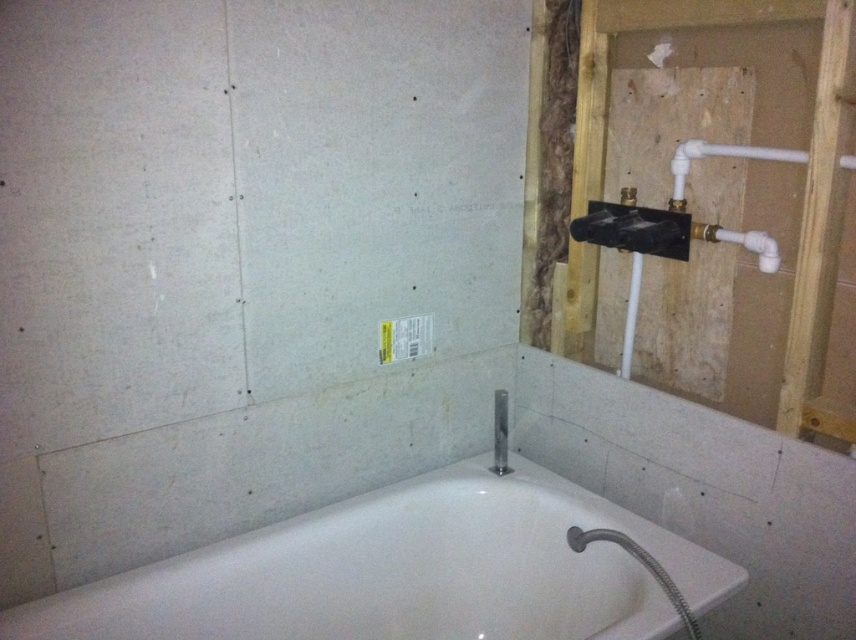
Question: Among these points, which one is nearest to the camera?

Choices:
 (A) (507, 422)
 (B) (560, 618)

Answer: (B)

Question: Which point is farther to the camera?

Choices:
 (A) (684, 595)
 (B) (500, 416)

Answer: (B)

Question: Does white glossy bathtub at center lie in front of satin nickel showerhead at upper center?

Choices:
 (A) no
 (B) yes

Answer: (B)

Question: Is white glossy bathtub at center wider than satin nickel showerhead at upper center?

Choices:
 (A) no
 (B) yes

Answer: (B)

Question: Considering the relative positions of white glossy bathtub at center and satin nickel showerhead at upper center in the image provided, where is white glossy bathtub at center located with respect to satin nickel showerhead at upper center?

Choices:
 (A) above
 (B) below

Answer: (B)